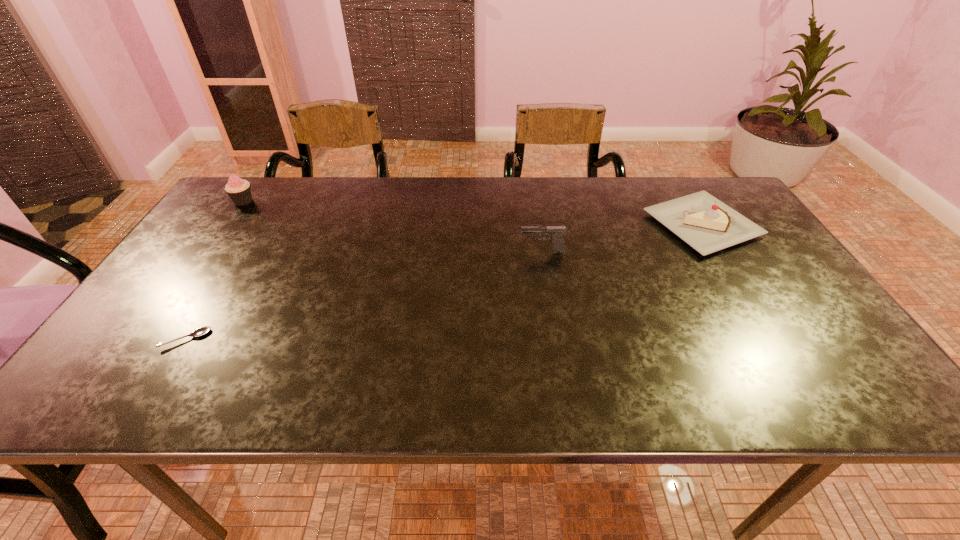
At what (x,y) coordinates should I click in order to perform the action: click on cupcake. Please return your answer as a coordinate pair (x, y). The image size is (960, 540). Looking at the image, I should click on (239, 190).

At what (x,y) coordinates should I click in order to perform the action: click on the second object from right to left. Please return your answer as a coordinate pair (x, y). This screenshot has width=960, height=540. Looking at the image, I should click on (557, 231).

Find the location of a particular element. the second shortest object is located at coordinates (708, 225).

In order to click on the rightmost object in this screenshot , I will do `click(708, 225)`.

This screenshot has height=540, width=960. Find the location of `the nearest object`. the nearest object is located at coordinates (200, 331).

Locate an element on the screen. the shortest object is located at coordinates (200, 331).

Find the location of a particular element. This screenshot has width=960, height=540. free space located on the front of the leftmost object is located at coordinates (230, 219).

Identify the location of free location located aim along the barrel of the pistol. This screenshot has width=960, height=540. (427, 252).

Where is `free space located 0.220m aim along the barrel of the pistol`? The height and width of the screenshot is (540, 960). free space located 0.220m aim along the barrel of the pistol is located at coordinates (438, 252).

You are a GUI agent. You are given a task and a screenshot of the screen. Output one action in this format:
    pyautogui.click(x=<x>, y=<y>)
    Task: Click on the vacant space located 0.140m aim along the barrel of the pistol
    The image size is (960, 540).
    Given the screenshot: What is the action you would take?
    pos(468,252)